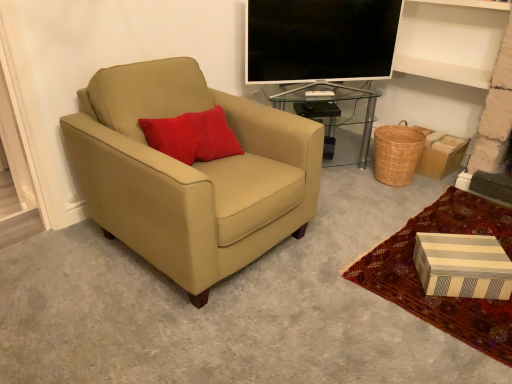
Question: Could you tell me if flat screen tv at upper center is facing woven brown basket at lower right?

Choices:
 (A) yes
 (B) no

Answer: (B)

Question: Does flat screen tv at upper center have a greater width compared to woven brown basket at lower right?

Choices:
 (A) yes
 (B) no

Answer: (B)

Question: Is flat screen tv at upper center shorter than woven brown basket at lower right?

Choices:
 (A) yes
 (B) no

Answer: (B)

Question: Does flat screen tv at upper center come in front of woven brown basket at lower right?

Choices:
 (A) no
 (B) yes

Answer: (B)

Question: Does flat screen tv at upper center have a lesser width compared to woven brown basket at lower right?

Choices:
 (A) yes
 (B) no

Answer: (A)

Question: Is flat screen tv at upper center taller than woven brown basket at lower right?

Choices:
 (A) no
 (B) yes

Answer: (B)

Question: Is the position of striped cardboard box at lower right more distant than that of woven brown basket at lower right?

Choices:
 (A) no
 (B) yes

Answer: (A)

Question: From a real-world perspective, is striped cardboard box at lower right positioned over woven brown basket at lower right based on gravity?

Choices:
 (A) yes
 (B) no

Answer: (B)

Question: Does striped cardboard box at lower right lie in front of woven brown basket at lower right?

Choices:
 (A) no
 (B) yes

Answer: (B)

Question: Is striped cardboard box at lower right far away from woven brown basket at lower right?

Choices:
 (A) yes
 (B) no

Answer: (B)

Question: Does striped cardboard box at lower right have a greater width compared to woven brown basket at lower right?

Choices:
 (A) no
 (B) yes

Answer: (B)

Question: From the image's perspective, is striped cardboard box at lower right located above woven brown basket at lower right?

Choices:
 (A) no
 (B) yes

Answer: (A)

Question: Is flat screen tv at upper center in contact with transparent glass table at center?

Choices:
 (A) yes
 (B) no

Answer: (B)